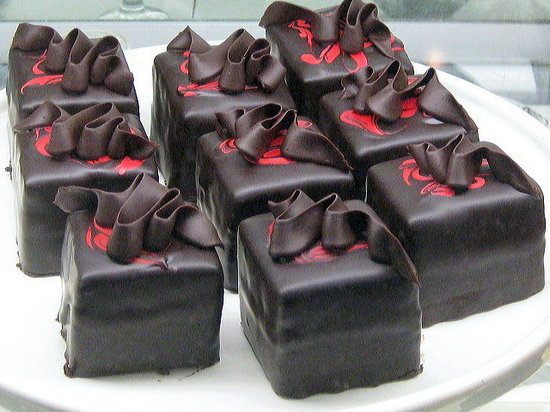
The width and height of the screenshot is (550, 412). I want to click on drinking glass, so click(135, 10).